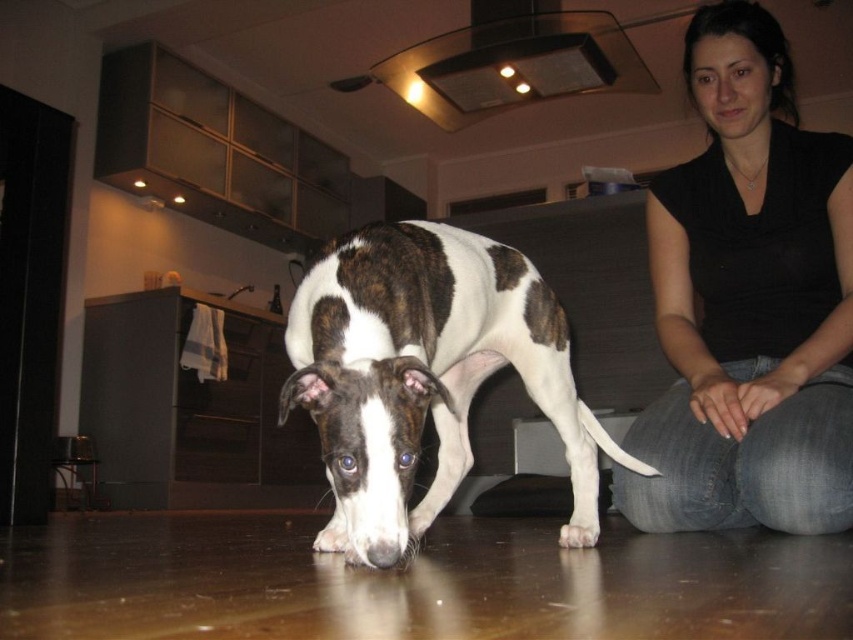
You are a photographer setting up a shoot in this scene. You need to place a small prop between the black cotton shirt at upper right and the brown and white fur at center. Which object should the prop be closer to if you want it to be near the larger item?

The black cotton shirt at upper right is bigger than the brown and white fur at center, so the prop should be placed closer to the black cotton shirt at upper right to be near the larger item.

You are standing in the kitchen and see two points marked on the floor. One is at point (x=648, y=513) and the other is at point (x=386, y=364). If you want to move from the point closer to you to the one further away, which point should you start at?

You should start at point (x=386, y=364) because point (x=648, y=513) is behind it, meaning point (x=386, y=364) is closer to you.

You are a photographer setting up a shoot in this scene. You want to ensure that both the black cotton shirt at upper right and the white fur paw at lower center are clearly visible in the final photo. Given their positions, which object should you adjust to avoid blocking the other?

The white fur paw at lower center is behind the black cotton shirt at upper right. To ensure both are visible, you should adjust the white fur paw at lower center to move it forward so it is no longer blocked by the black cotton shirt at upper right.